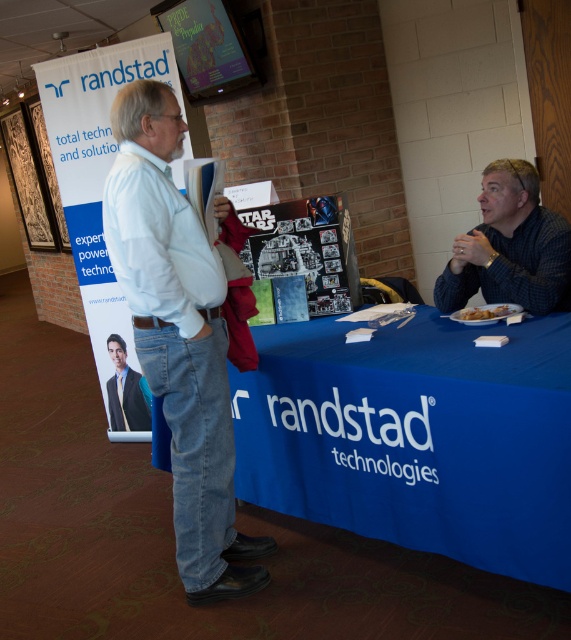
Question: Does blue fabric table at center have a smaller size compared to white cotton shirt at center?

Choices:
 (A) yes
 (B) no

Answer: (B)

Question: Considering the real-world distances, which object is farthest from the dark blue suit at center?

Choices:
 (A) white cotton shirt at center
 (B) blue textured shirt at center

Answer: (B)

Question: Does white cotton shirt at center have a smaller size compared to dark blue suit at center?

Choices:
 (A) no
 (B) yes

Answer: (A)

Question: Does dark blue suit at center have a smaller size compared to golden crispy hash browns at lower right?

Choices:
 (A) no
 (B) yes

Answer: (A)

Question: Which point is farther to the camera?

Choices:
 (A) golden crispy hash browns at lower right
 (B) blue textured shirt at center

Answer: (B)

Question: Among these objects, which one is farthest from the camera?

Choices:
 (A) white cotton shirt at center
 (B) blue textured shirt at center

Answer: (B)